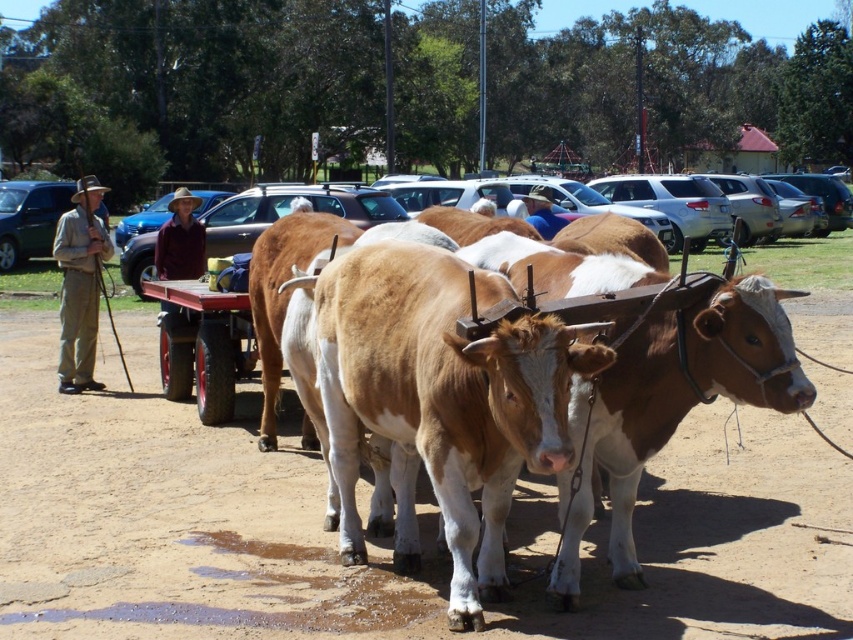
Is brown smooth cow at center thinner than matte black suv at left?

Indeed, brown smooth cow at center has a lesser width compared to matte black suv at left.

Is point (334, 317) behind point (36, 234)?

That is False.

Identify the location of brown smooth cow at center. (440, 397).

Does khaki fabric pants at left have a smaller size compared to brown cotton shirt at center?

Actually, khaki fabric pants at left might be larger than brown cotton shirt at center.

Can you confirm if khaki fabric pants at left is wider than brown cotton shirt at center?

Yes, khaki fabric pants at left is wider than brown cotton shirt at center.

This screenshot has width=853, height=640. What are the coordinates of `khaki fabric pants at left` in the screenshot? It's located at (80, 284).

Looking at this image, how distant is brown smooth cow at center from khaki fabric pants at left?

They are 19.82 feet apart.

Between brown smooth cow at center and khaki fabric pants at left, which one appears on the right side from the viewer's perspective?

From the viewer's perspective, brown smooth cow at center appears more on the right side.

Does point (404, 296) lie behind point (70, 356)?

No, (404, 296) is in front of (70, 356).

At what (x,y) coordinates should I click in order to perform the action: click on brown smooth cow at center. Please return your answer as a coordinate pair (x, y). The image size is (853, 640). Looking at the image, I should click on (440, 397).